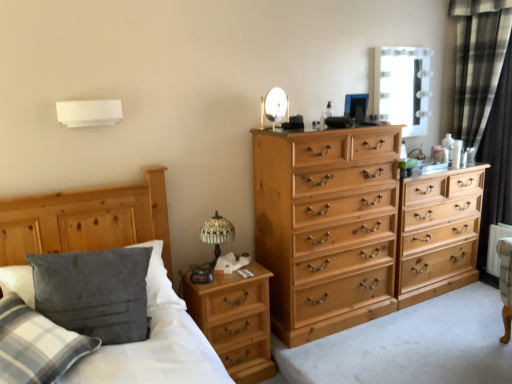
Based on the photo, measure the distance between point (x=268, y=353) and camera.

Point (x=268, y=353) is 2.56 meters from camera.

The width and height of the screenshot is (512, 384). What do you see at coordinates (274, 106) in the screenshot?
I see `metallic round mirror at upper center` at bounding box center [274, 106].

You are a GUI agent. You are given a task and a screenshot of the screen. Output one action in this format:
    pyautogui.click(x=<x>, y=<y>)
    Task: Click on the metallic round mirror at upper center
    This screenshot has height=384, width=512.
    Given the screenshot: What is the action you would take?
    pyautogui.click(x=274, y=106)

Where is `white glossy mirror at upper right`? This screenshot has height=384, width=512. white glossy mirror at upper right is located at coordinates coord(403,87).

Locate an element on the screen. black plaid curtain at right is located at coordinates coord(486,101).

The image size is (512, 384). Describe the element at coordinates (345, 231) in the screenshot. I see `natural wood chest of drawers at center, which is the second chest of drawers from right to left` at that location.

What do you see at coordinates (438, 234) in the screenshot? I see `natural wood chest of drawers at right, arranged as the second chest of drawers when viewed from the left` at bounding box center [438, 234].

The width and height of the screenshot is (512, 384). What are the coordinates of `white matte rectangular light fixture at upper left` in the screenshot? It's located at (89, 112).

I want to click on wooden nightstand at lower left, so click(234, 320).

Between point (318, 211) and point (286, 119), which one is positioned in front?

The point (286, 119) is in front.

Is natural wood chest of drawers at center, which is the second chest of drawers from right to left, inside or outside of metallic round mirror at upper center?

natural wood chest of drawers at center, which is the second chest of drawers from right to left, exists outside the volume of metallic round mirror at upper center.

Does natural wood chest of drawers at center, which is the second chest of drawers from right to left, turn towards metallic round mirror at upper center?

No.

Considering the relative sizes of black plaid curtain at right and white matte rectangular light fixture at upper left in the image provided, is black plaid curtain at right wider than white matte rectangular light fixture at upper left?

Indeed, black plaid curtain at right has a greater width compared to white matte rectangular light fixture at upper left.

Is white matte rectangular light fixture at upper left surrounded by black plaid curtain at right?

No, white matte rectangular light fixture at upper left is not surrounded by black plaid curtain at right.

Is black plaid curtain at right turned away from white matte rectangular light fixture at upper left?

No, black plaid curtain at right is not facing the opposite direction of white matte rectangular light fixture at upper left.

Is white glossy mirror at upper right directly adjacent to wooden bed frame at left?

No, white glossy mirror at upper right is not next to wooden bed frame at left.

From a real-world perspective, is white glossy mirror at upper right physically above wooden bed frame at left?

Yes, from a real-world perspective, white glossy mirror at upper right is over wooden bed frame at left

Which object is positioned more to the left, white glossy mirror at upper right or wooden bed frame at left?

Positioned to the left is wooden bed frame at left.

From the image's perspective, which object appears higher, white glossy mirror at upper right or wooden bed frame at left?

white glossy mirror at upper right.

From the image's perspective, which object appears higher, white matte rectangular light fixture at upper left or wooden nightstand at lower left?

white matte rectangular light fixture at upper left appears higher in the image.

Is white matte rectangular light fixture at upper left situated inside wooden nightstand at lower left or outside?

white matte rectangular light fixture at upper left is not enclosed by wooden nightstand at lower left.

What are the coordinates of `pillow located below the black plaid curtain at right (from the image's perspective)` in the screenshot? It's located at (36, 344).

Who is more distant, black plaid curtain at right or velvety gray pillow at lower left?

black plaid curtain at right is further from the camera.

Can you confirm if black plaid curtain at right is positioned to the left of velvety gray pillow at lower left?

No, black plaid curtain at right is not to the left of velvety gray pillow at lower left.

Based on the photo, is velvety gray pillow at lower left with black plaid curtain at right?

They are not placed beside each other.

From the picture: Is velvety gray pillow at lower left oriented away from black plaid curtain at right?

No, black plaid curtain at right is not at the back of velvety gray pillow at lower left.

From the picture: Which is more to the right, velvety gray pillow at lower left or black plaid curtain at right?

From the viewer's perspective, black plaid curtain at right appears more on the right side.

Who is shorter, velvety gray pillow at lower left or black plaid curtain at right?

Standing shorter between the two is velvety gray pillow at lower left.

Does wooden bed frame at left have a lesser width compared to natural wood chest of drawers at right, arranged as the second chest of drawers when viewed from the left?

No, wooden bed frame at left is not thinner than natural wood chest of drawers at right, arranged as the second chest of drawers when viewed from the left.

From the image's perspective, who appears lower, wooden bed frame at left or natural wood chest of drawers at right, the 1th chest of drawers viewed from the right?

wooden bed frame at left appears lower in the image.

Can you confirm if wooden bed frame at left is positioned to the left of natural wood chest of drawers at right, arranged as the second chest of drawers when viewed from the left?

Yes, wooden bed frame at left is to the left of natural wood chest of drawers at right, arranged as the second chest of drawers when viewed from the left.

Which of these two, wooden bed frame at left or natural wood chest of drawers at right, arranged as the second chest of drawers when viewed from the left, stands taller?

With more height is natural wood chest of drawers at right, arranged as the second chest of drawers when viewed from the left.

Starting from the metallic round mirror at upper center, which chest of drawers is the 1st one to the right? Please provide its 2D coordinates.

[(345, 231)]

Identify the location of lamp on the left of black plaid curtain at right. (89, 112).

When comparing their distances from white matte rectangular light fixture at upper left, does white glossy mirror at upper right or metallic round mirror at upper center seem closer?

metallic round mirror at upper center is positioned closer to the anchor white matte rectangular light fixture at upper left.

When comparing their distances from natural wood chest of drawers at center, which is the 1th chest of drawers from left to right, does white matte rectangular light fixture at upper left or metallic round mirror at upper center seem closer?

metallic round mirror at upper center is closer to natural wood chest of drawers at center, which is the 1th chest of drawers from left to right.

In the scene shown: When comparing their distances from white glossy mirror at upper right, does velvety gray pillow at lower left or wooden nightstand at lower left seem closer?

Among the two, wooden nightstand at lower left is located nearer to white glossy mirror at upper right.

Which object lies further to the anchor point metallic round mirror at upper center, wooden nightstand at lower left or stained glass table lamp at center left?

wooden nightstand at lower left is positioned further to the anchor metallic round mirror at upper center.

Which object lies further to the anchor point wooden bed frame at left, metallic round mirror at upper center or stained glass table lamp at center left?

metallic round mirror at upper center is further to wooden bed frame at left.

Which object lies further to the anchor point white glossy mirror at upper right, white matte rectangular light fixture at upper left or metallic round mirror at upper center?

The object further to white glossy mirror at upper right is white matte rectangular light fixture at upper left.

Based on their spatial positions, is metallic round mirror at upper center or wooden bed frame at left further from wooden nightstand at lower left?

Based on the image, metallic round mirror at upper center appears to be further to wooden nightstand at lower left.

When comparing their distances from wooden nightstand at lower left, does metallic round mirror at upper center or white glossy mirror at upper right seem closer?

Among the two, metallic round mirror at upper center is located nearer to wooden nightstand at lower left.

Locate an element on the screen. The width and height of the screenshot is (512, 384). chest of drawers between metallic round mirror at upper center and white glossy mirror at upper right from left to right is located at coordinates (345, 231).

Locate an element on the screen. pillow that lies between metallic round mirror at upper center and wooden nightstand at lower left from top to bottom is located at coordinates (36, 344).

Locate an element on the screen. pillow that lies between white matte rectangular light fixture at upper left and wooden nightstand at lower left from top to bottom is located at coordinates (36, 344).

This screenshot has width=512, height=384. I want to click on nightstand situated between stained glass table lamp at center left and natural wood chest of drawers at center, which is the 1th chest of drawers from left to right, from left to right, so click(x=234, y=320).